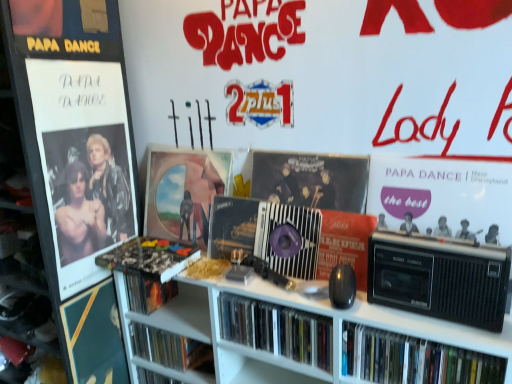
This screenshot has height=384, width=512. I want to click on empty space that is ontop of black plastic radio at right, which is the 1th book from right to left (from a real-world perspective), so click(x=426, y=342).